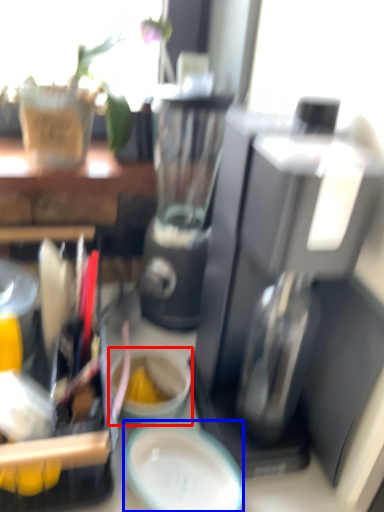
Question: Which of the following is the closest to the observer, coffee cup (highlighted by a red box) or plate (highlighted by a blue box)?

Choices:
 (A) coffee cup
 (B) plate

Answer: (B)